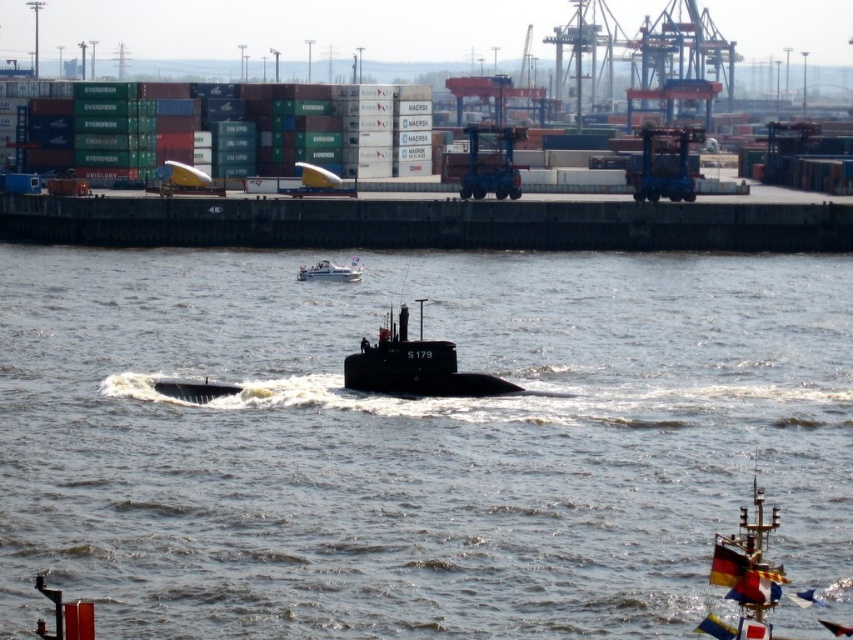
Consider the image. You are a sailor on the black matte submarine at center and want to communicate with the port control tower located near the green matte containers at upper left. Since you have a megaphone with a range of 100 meters, can you reach them?

The green matte containers at upper left are further to the viewer than the black matte submarine at center, so the distance between them is less than 100 meters. Therefore, you can reach the port control tower with your megaphone.